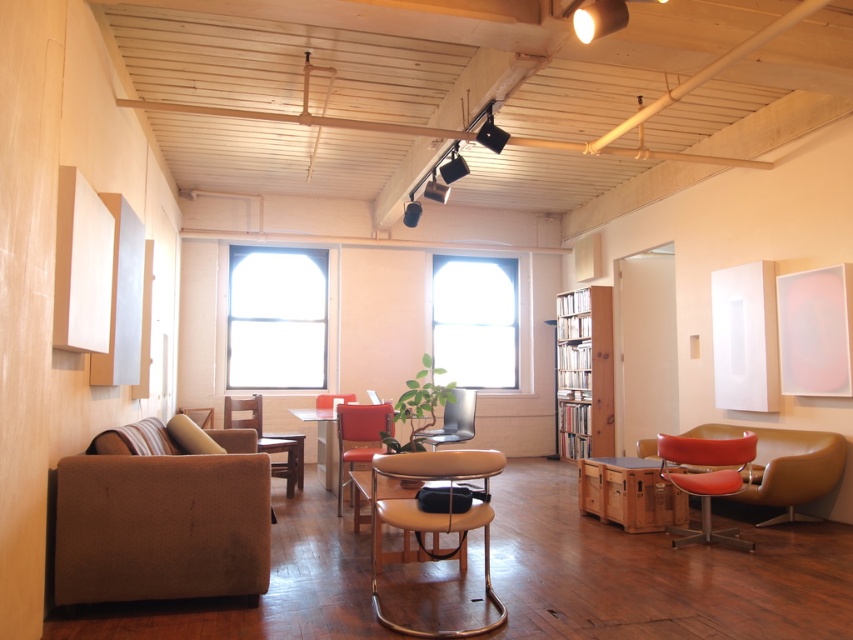
You are planning to place a new coffee table in the living room. The coffee table you have is 1.2 meters wide. Considering the space between the matte orange swivel chair at lower right and the brown leather armchair at center, can the coffee table fit there?

The matte orange swivel chair at lower right is smaller than the brown leather armchair at center, but the distance between them isn